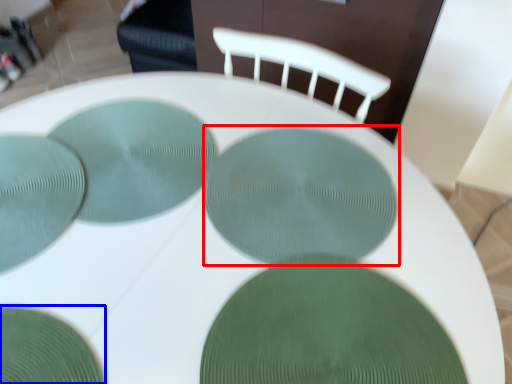
Question: Which of the following is the closest to the observer, glass plate (highlighted by a red box) or glass plate (highlighted by a blue box)?

Choices:
 (A) glass plate
 (B) glass plate

Answer: (B)